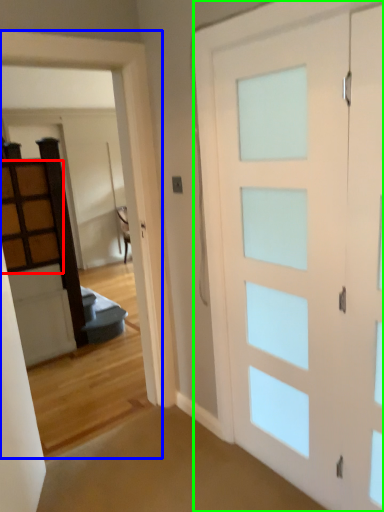
Question: Considering the real-world distances, which object is closest to cabinetry (highlighted by a red box)? garage door (highlighted by a blue box) or barn door (highlighted by a green box).

Choices:
 (A) garage door
 (B) barn door

Answer: (A)